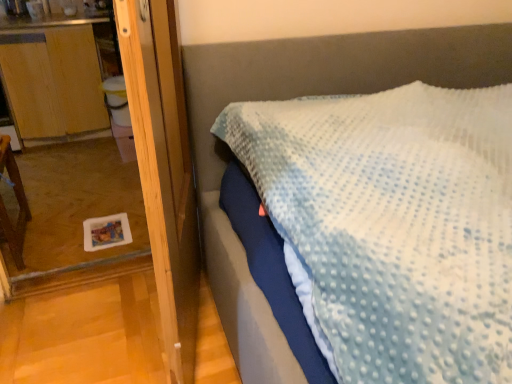
I want to click on free space behind brown wooden chair at left, so click(64, 205).